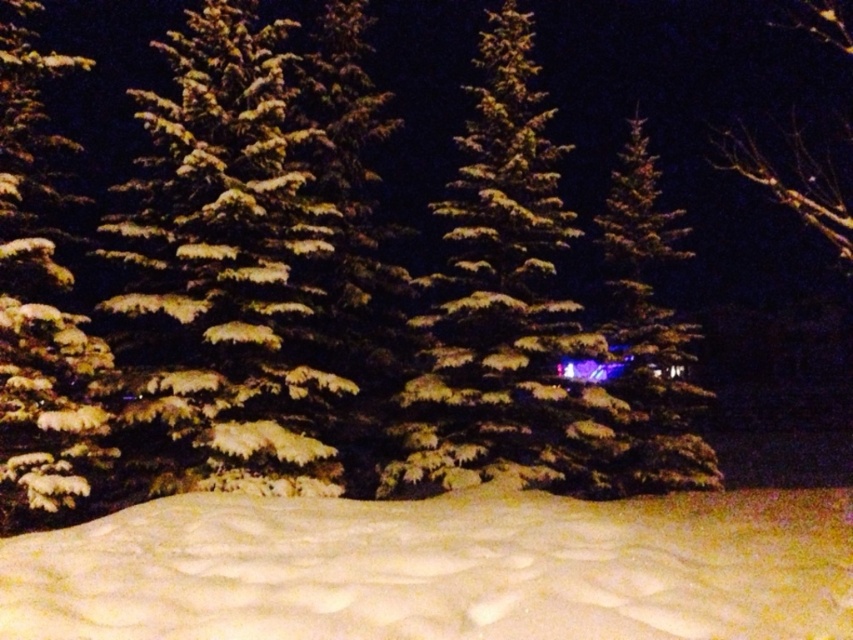
Question: Which object is farther from the camera taking this photo?

Choices:
 (A) snow-covered fir tree at center
 (B) white fluffy snow at lower center
 (C) green matte evergreen at upper right
 (D) snow-covered pine tree at left

Answer: (A)

Question: Among these points, which one is nearest to the camera?

Choices:
 (A) (44, 289)
 (B) (758, 150)
 (C) (503, 256)
 (D) (177, 552)

Answer: (D)

Question: Based on their relative distances, which object is nearer to the snow-covered pine tree at left?

Choices:
 (A) green matte evergreen at upper right
 (B) snow-covered fir tree at center

Answer: (B)

Question: Is the position of white fluffy snow at lower center more distant than that of snow-covered fir tree at center?

Choices:
 (A) yes
 (B) no

Answer: (B)

Question: Is white fluffy snow at lower center wider than snow-covered fir tree at center?

Choices:
 (A) yes
 (B) no

Answer: (B)

Question: In this image, where is white fluffy snow at lower center located relative to snow-covered fir tree at center?

Choices:
 (A) right
 (B) left

Answer: (B)